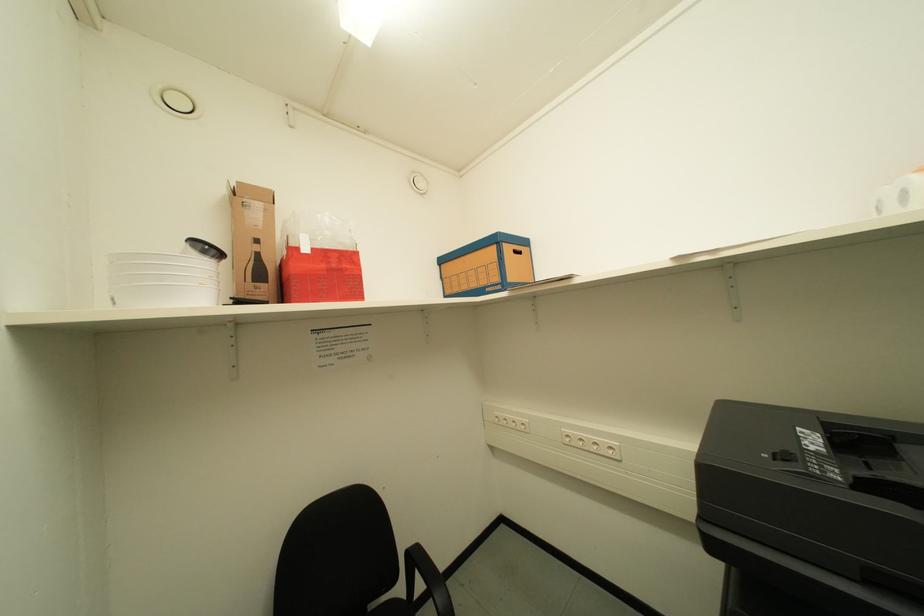
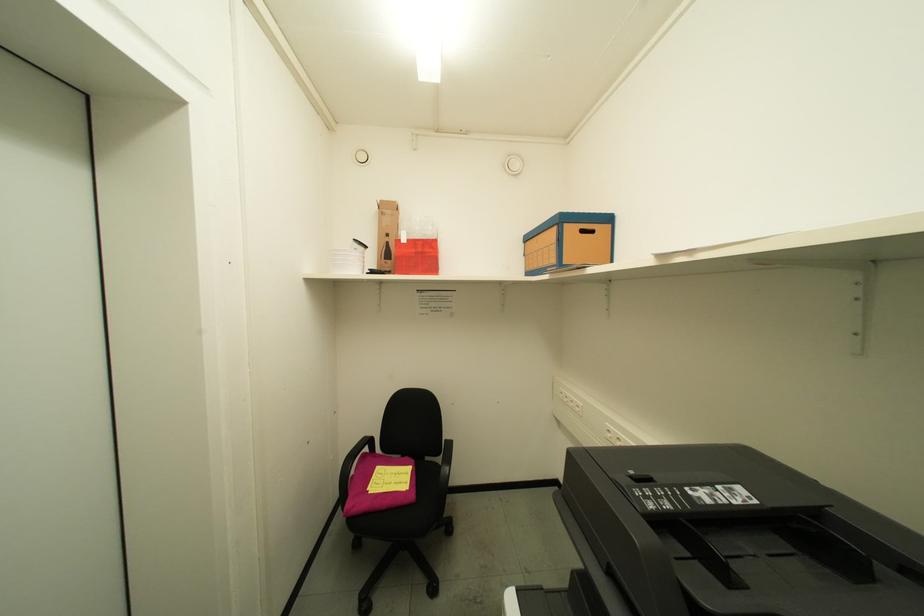
Question: The images are taken continuously from a first-person perspective. In which direction is your viewpoint rotating?

Choices:
 (A) Left
 (B) Right
 (C) Up
 (D) Down

Answer: (A)